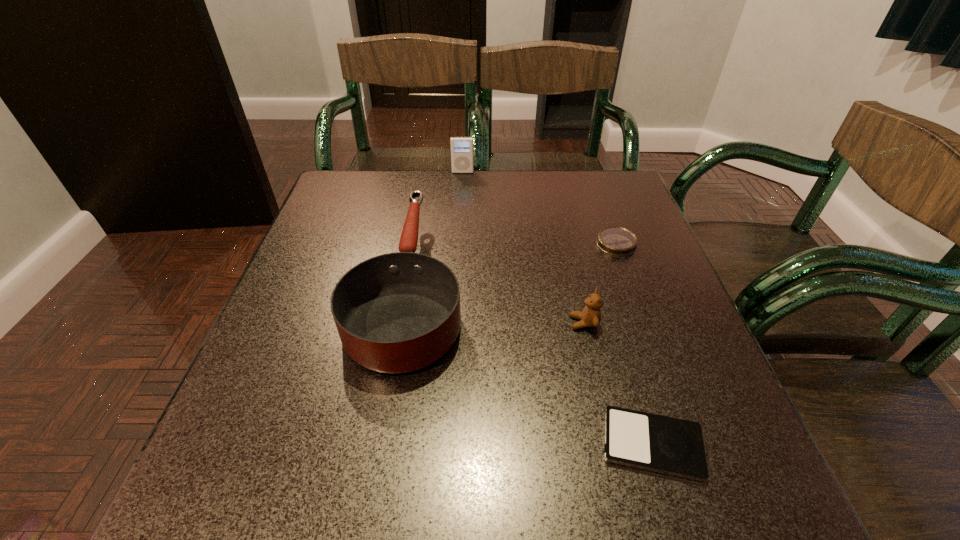
Where is `free space located on the handle side of the pan`? The width and height of the screenshot is (960, 540). free space located on the handle side of the pan is located at coordinates (427, 181).

Find the location of `vacant region located 0.070m on the front-facing side of the teddy bear`. vacant region located 0.070m on the front-facing side of the teddy bear is located at coordinates (535, 323).

Find the location of a particular element. This screenshot has width=960, height=540. vacant region located on the front-facing side of the teddy bear is located at coordinates (441, 323).

I want to click on free location located on the front-facing side of the teddy bear, so click(x=462, y=323).

You are a GUI agent. You are given a task and a screenshot of the screen. Output one action in this format:
    pyautogui.click(x=<x>, y=<y>)
    Task: Click on the vacant space located 0.120m on the front of the compass
    
    Given the screenshot: What is the action you would take?
    pyautogui.click(x=635, y=294)

The width and height of the screenshot is (960, 540). I want to click on free location located 0.290m on the left of the nearer iPod, so click(410, 444).

Locate an element on the screen. This screenshot has width=960, height=540. object present at the far edge is located at coordinates (462, 159).

I want to click on object present at the near edge, so click(x=657, y=443).

The image size is (960, 540). I want to click on object at the left edge, so click(399, 312).

You are a GUI agent. You are given a task and a screenshot of the screen. Output one action in this format:
    pyautogui.click(x=<x>, y=<y>)
    Task: Click on the compass positioned at the right edge
    This screenshot has width=960, height=540.
    Given the screenshot: What is the action you would take?
    pyautogui.click(x=617, y=241)